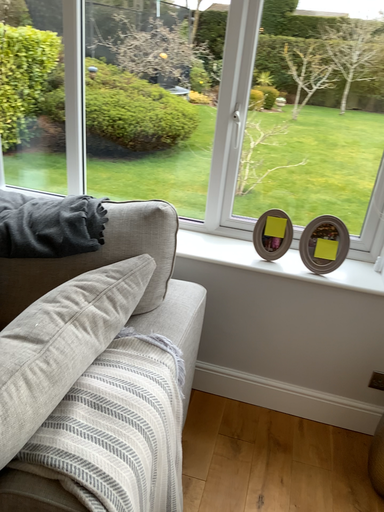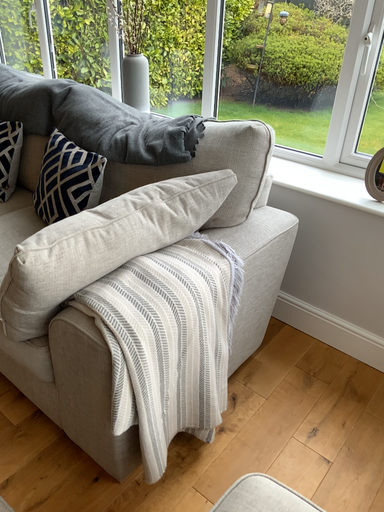
Question: Which way did the camera rotate in the video?

Choices:
 (A) rotated right
 (B) rotated left

Answer: (B)